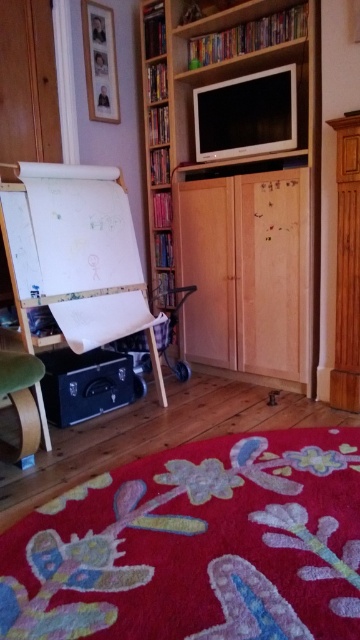
You are a guest entering the room and want to sit down. You see the white matte easel at left and the green fabric chair at lower left. Which object should you approach to find a place to sit?

The green fabric chair at lower left is the object you should approach to sit down, as chairs are designed for sitting. The white matte easel at left is positioned above the chair but is meant for holding papers or artwork, not for seating.

You are organizing a small party and need to place a 1.2 meter wide banner between the wooden bookcase at center and the green fabric chair at lower left. Can the banner fit between them?

The wooden bookcase at center is wider than the green fabric chair at lower left. However, the banner requires 1.2 meters of space between them. Since the description only mentions the width comparison between the objects and not the distance between them, it is impossible to determine if the banner can fit based on the provided information.

You are standing in the living room and want to place a new bookshelf. The existing wooden bookcase at center is located at point (236, 189). If you want to place the new bookshelf 0.3 meters to the right of the existing one, what coordinate would that be?

The new bookshelf would be placed at coordinate (236, 189) plus 0.3 meters to the right. Since the coordinate system might vary, but assuming the x and y axes are standard, moving right would increase the x value. However, without knowing the scale of the coordinate system, an exact coordinate can not be calculated. The answer should state that the new position is 0.3 meters to the right of point (236, 189).